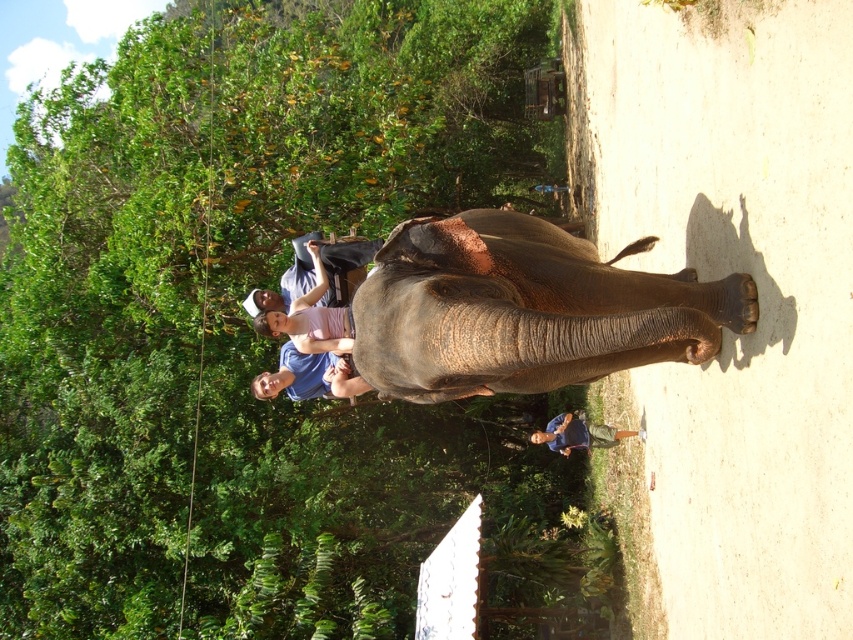
Is point (341, 328) farther from viewer compared to point (601, 442)?

No.

Can you confirm if matte blue shirt at center is positioned below blue fabric shirt at center?

Actually, matte blue shirt at center is above blue fabric shirt at center.

Which is in front, point (321, 292) or point (556, 428)?

Point (321, 292)

The width and height of the screenshot is (853, 640). Find the location of `matte blue shirt at center`. matte blue shirt at center is located at coordinates (310, 346).

Who is shorter, gray textured elephant at center or blue fabric shirt at center?

blue fabric shirt at center is shorter.

Which of these two, gray textured elephant at center or blue fabric shirt at center, stands taller?

With more height is gray textured elephant at center.

Between point (668, 355) and point (627, 429), which one is positioned in front?

Point (668, 355)

At what (x,y) coordinates should I click in order to perform the action: click on gray textured elephant at center. Please return your answer as a coordinate pair (x, y). This screenshot has width=853, height=640. Looking at the image, I should click on (525, 308).

Who is positioned more to the left, green leafy tree at upper left or gray textured elephant at center?

From the viewer's perspective, green leafy tree at upper left appears more on the left side.

Does green leafy tree at upper left appear on the left side of gray textured elephant at center?

Correct, you'll find green leafy tree at upper left to the left of gray textured elephant at center.

Which is in front, point (125, 618) or point (610, 296)?

Point (610, 296)

I want to click on green leafy tree at upper left, so click(x=281, y=272).